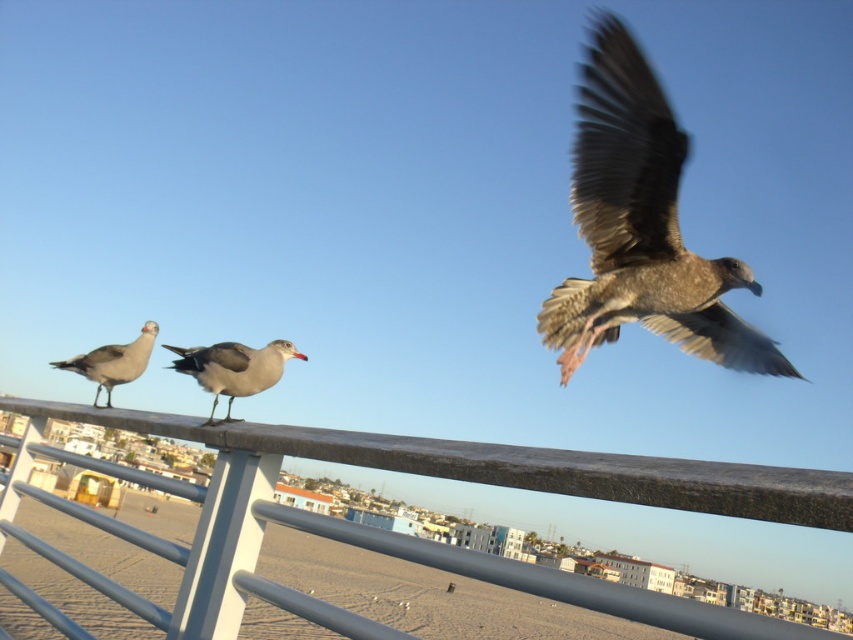
Does brown feathered bird at upper right have a smaller size compared to gray matte seagull at left?

No.

Does brown feathered bird at upper right have a greater width compared to gray matte seagull at left?

Indeed, brown feathered bird at upper right has a greater width compared to gray matte seagull at left.

What do you see at coordinates (641, 227) in the screenshot? I see `brown feathered bird at upper right` at bounding box center [641, 227].

You are a GUI agent. You are given a task and a screenshot of the screen. Output one action in this format:
    pyautogui.click(x=<x>, y=<y>)
    Task: Click on the brown feathered bird at upper right
    
    Given the screenshot: What is the action you would take?
    pyautogui.click(x=641, y=227)

Between metallic gray fence at upper center and brown feathered bird at upper right, which one has more height?

With more height is brown feathered bird at upper right.

Is point (592, 476) behind point (724, 275)?

No, (592, 476) is in front of (724, 275).

The height and width of the screenshot is (640, 853). I want to click on metallic gray fence at upper center, so click(x=450, y=477).

Can you confirm if gray matte seagull at center is positioned below gray matte seagull at left?

Actually, gray matte seagull at center is above gray matte seagull at left.

Is gray matte seagull at center positioned at the back of gray matte seagull at left?

No, it is in front of gray matte seagull at left.

Which is behind, point (189, 371) or point (86, 353)?

Positioned behind is point (86, 353).

At what (x,y) coordinates should I click in order to perform the action: click on gray matte seagull at center. Please return your answer as a coordinate pair (x, y). The width and height of the screenshot is (853, 640). Looking at the image, I should click on (233, 369).